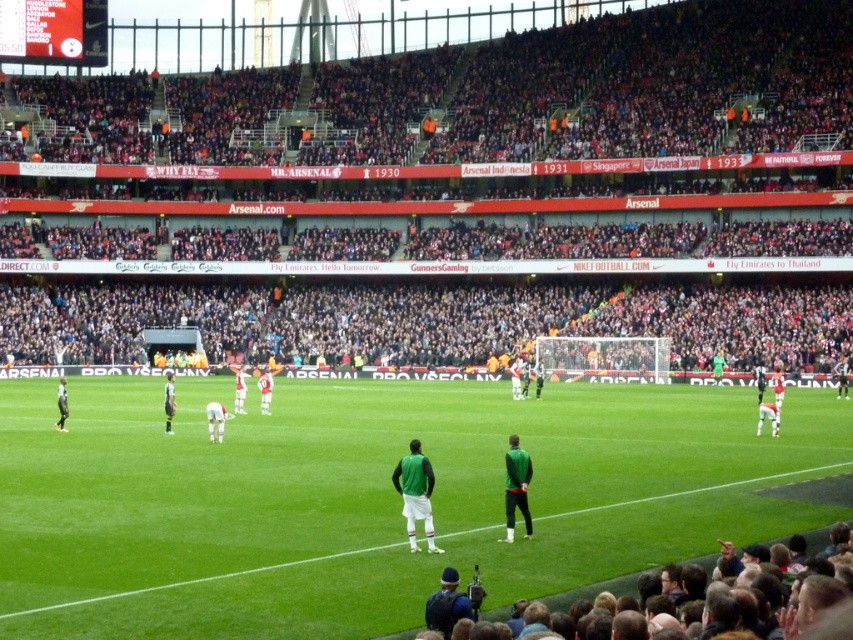
You are a photographer standing at the center of the stadium. You want to take a photo of the green matte jersey at center. Based on the coordinates provided, which direction should you move to get a better shot?

The green matte jersey at center is located at coordinates point (x=416, y=493). Since you are at the center of the stadium, you should move towards the direction of the point to capture the jersey in your shot.

You are a photographer standing at the edge of the pitch. You want to take a photo of the green grass field at center and the green matte jacket at center. Which object will appear wider in the photo?

The green grass field at center will appear wider in the photo because its width is larger than the green matte jacket at center.